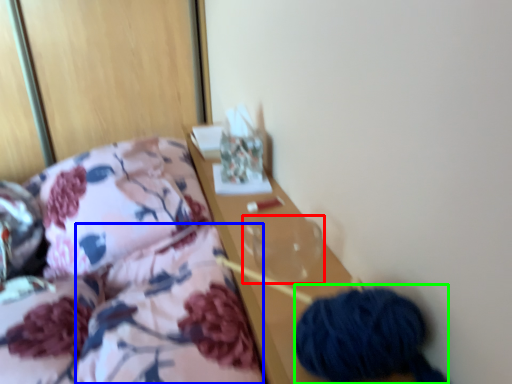
Question: Considering the real-world distances, which object is closest to glass vase (highlighted by a red box)? quilt (highlighted by a blue box) or material (highlighted by a green box).

Choices:
 (A) quilt
 (B) material

Answer: (A)